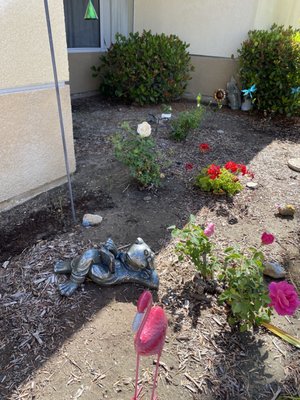
Find the location of `shade`. shade is located at coordinates (129, 203).